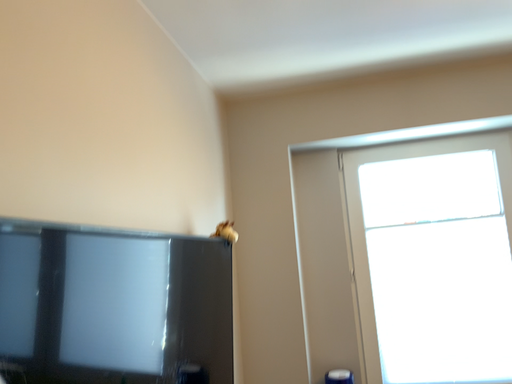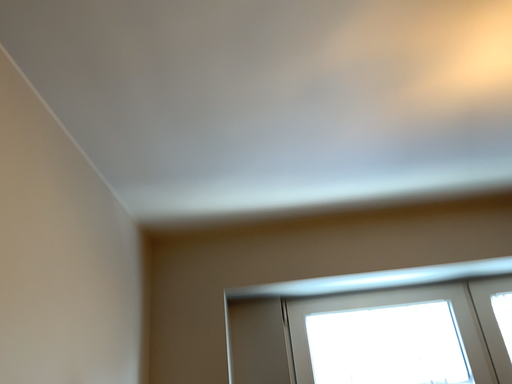
Question: Which way did the camera rotate in the video?

Choices:
 (A) rotated downward
 (B) rotated upward

Answer: (B)